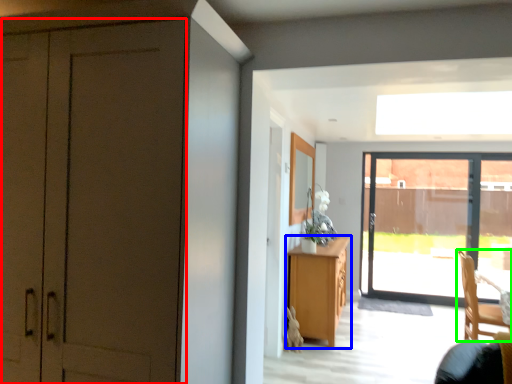
Question: Which object is positioned farthest from door (highlighted by a red box)? Select from cabinetry (highlighted by a blue box) and chair (highlighted by a green box).

Choices:
 (A) cabinetry
 (B) chair

Answer: (B)